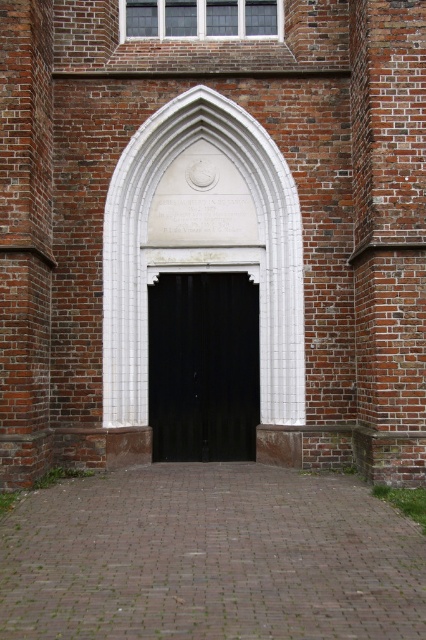
From the picture: You are standing at the point marked as point (253,163). The plaque above the archway is 14.42 meters away from you. If you want to reach the plaque, which direction should you move relative to the archway?

The plaque above the archway is 14.42 meters away from point (253,163). To reach the plaque, you should move towards the archway since the plaque is located above it.

You are an architect designing a new building and want to ensure that the white stone archway at center is proportionally balanced with the black wooden door at center. Based on the image, which object is taller?

The black wooden door at center is taller than the white stone archway at center according to the description.